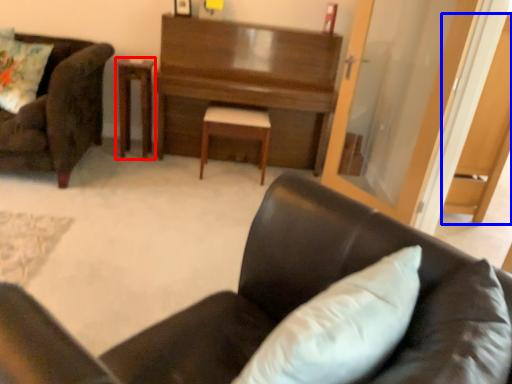
Question: Among these objects, which one is farthest to the camera, table (highlighted by a red box) or dark (highlighted by a blue box)?

Choices:
 (A) table
 (B) dark

Answer: (A)